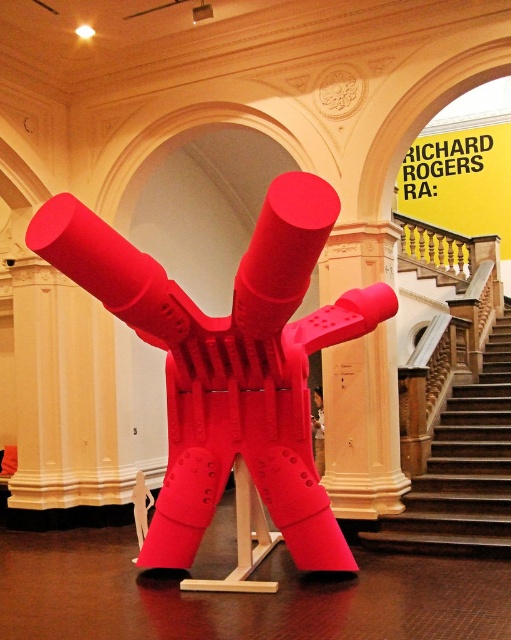
The height and width of the screenshot is (640, 511). What do you see at coordinates (228, 364) in the screenshot?
I see `matte plastic sculpture at center` at bounding box center [228, 364].

Who is positioned more to the left, matte plastic sculpture at center or matte white column at center?

From the viewer's perspective, matte plastic sculpture at center appears more on the left side.

Who is more forward, (305, 474) or (334, 234)?

Point (305, 474)

This screenshot has width=511, height=640. Find the location of `matte plastic sculpture at center`. matte plastic sculpture at center is located at coordinates (228, 364).

Measure the distance from matte plastic sculpture at center to wooden staircase at center.

They are 8.29 feet apart.

Can you confirm if matte plastic sculpture at center is wider than wooden staircase at center?

Indeed, matte plastic sculpture at center has a greater width compared to wooden staircase at center.

Between point (271, 193) and point (468, 403), which one is positioned in front?

Point (271, 193)

Where is `matte plastic sculpture at center`? This screenshot has width=511, height=640. matte plastic sculpture at center is located at coordinates (228, 364).

Does matte white column at center have a smaller size compared to wooden staircase at center?

Correct, matte white column at center occupies less space than wooden staircase at center.

Does matte white column at center have a lesser height compared to wooden staircase at center?

In fact, matte white column at center may be taller than wooden staircase at center.

The image size is (511, 640). What do you see at coordinates (362, 426) in the screenshot?
I see `matte white column at center` at bounding box center [362, 426].

Find the location of a particular element. The height and width of the screenshot is (640, 511). matte white column at center is located at coordinates (362, 426).